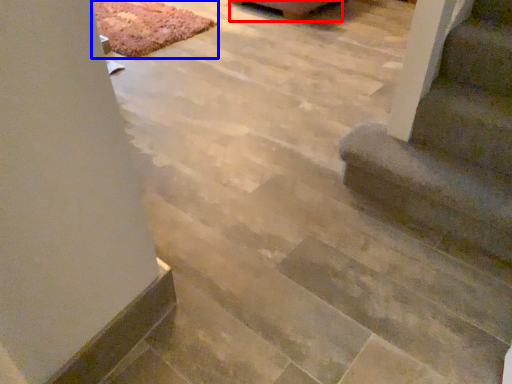
Question: Which object appears closest to the camera in this image, furniture (highlighted by a red box) or mat (highlighted by a blue box)?

Choices:
 (A) furniture
 (B) mat

Answer: (B)